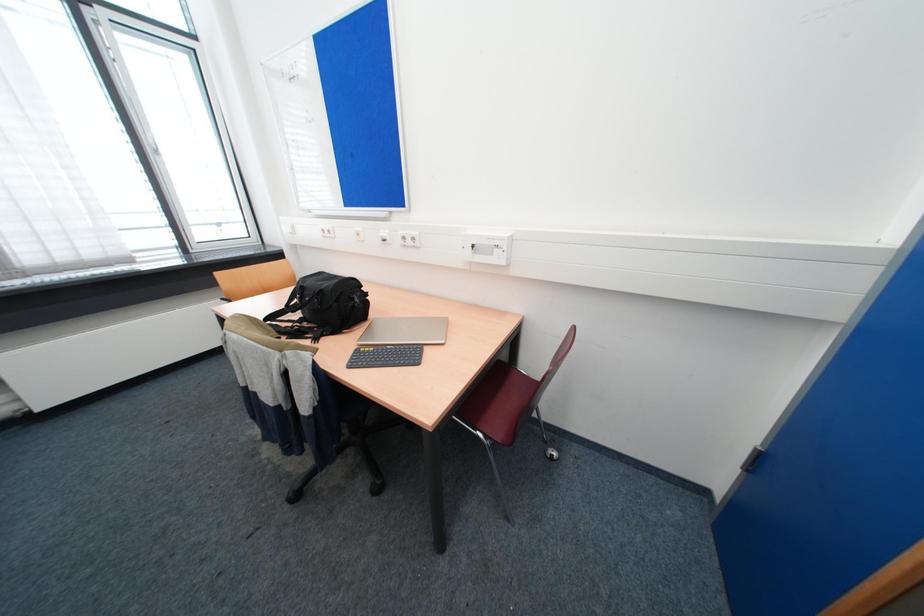
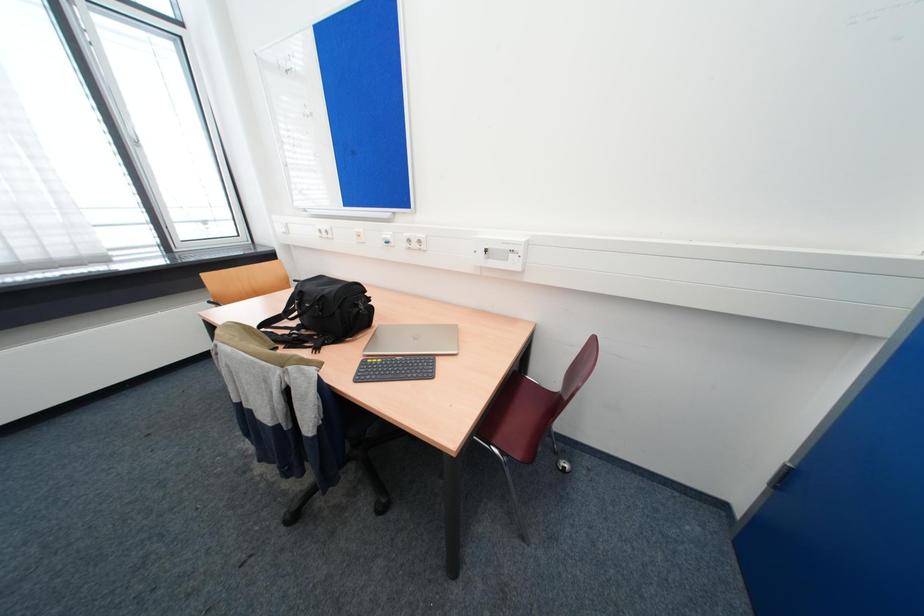
Question: The camera is either moving clockwise (left) or counter-clockwise (right) around the object. The first image is from the beginning of the video and the second image is from the end. Is the camera moving left or right when shooting the video?

Choices:
 (A) Left
 (B) Right

Answer: (A)